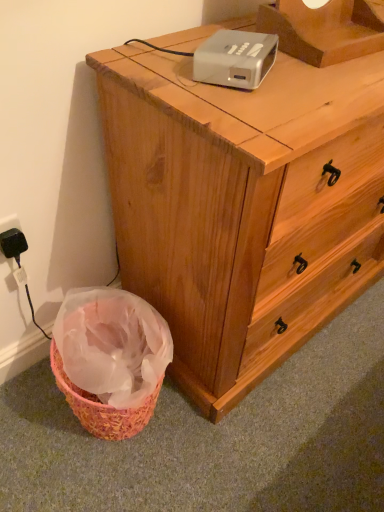
I want to click on vacant space to the right of white plastic projector at upper center, so click(x=317, y=85).